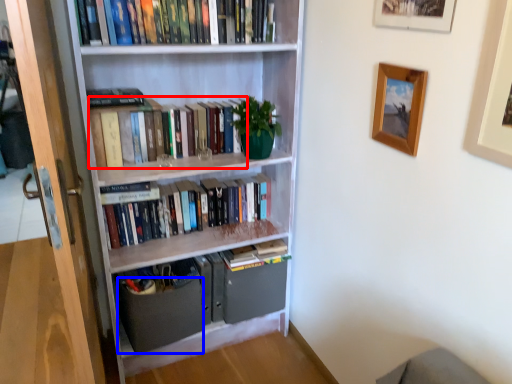
Question: Which of the following is the closest to the observer, book (highlighted by a red box) or drawer (highlighted by a blue box)?

Choices:
 (A) book
 (B) drawer

Answer: (A)